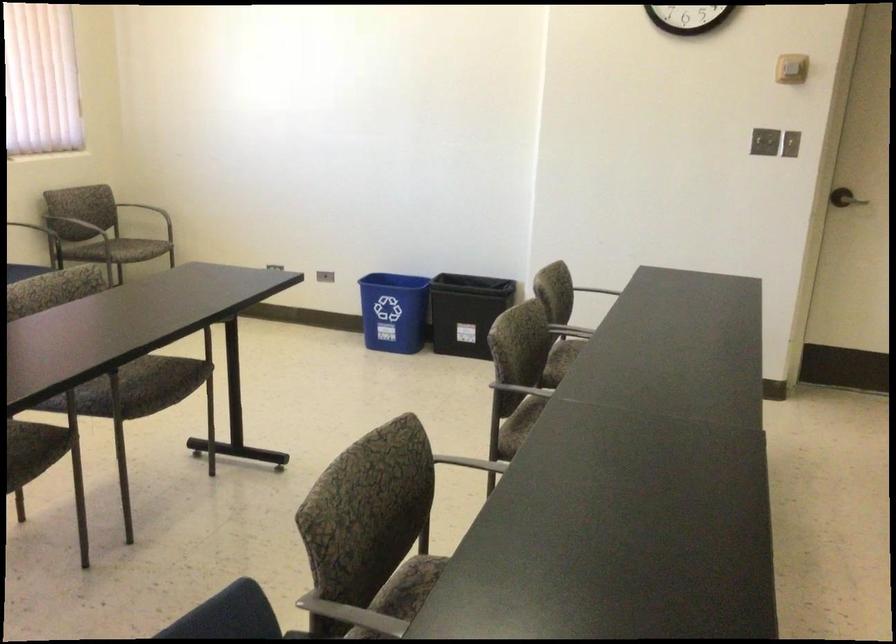
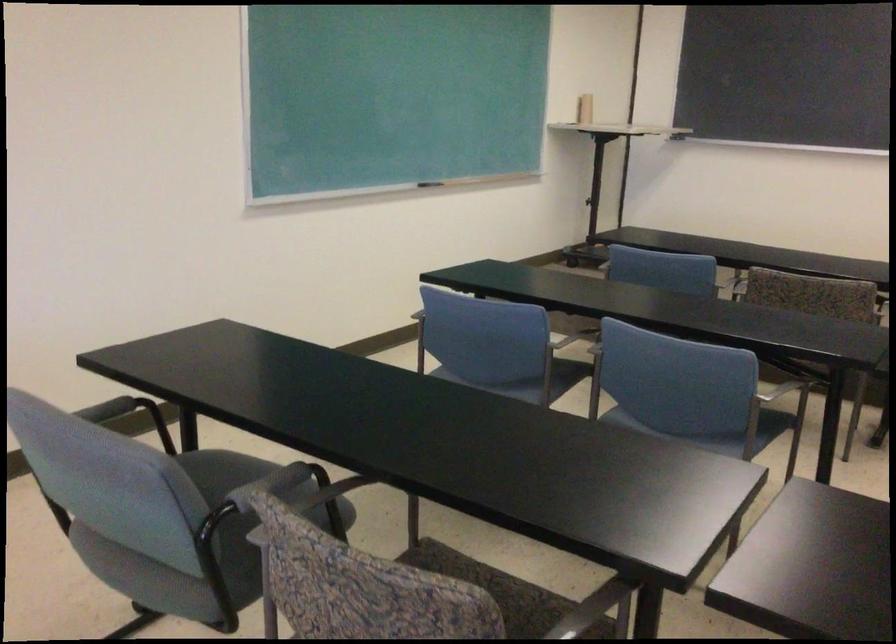
Question: Which direction would the cameraman need to move to produce the second image? Reply with the corresponding letter.

Choices:
 (A) Left
 (B) Right
 (C) Forward
 (D) Backward

Answer: (D)